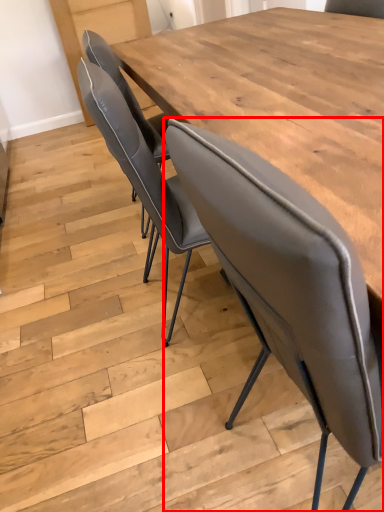
Question: From the image's perspective, considering the relative positions of chair (annotated by the red box) and table in the image provided, where is chair (annotated by the red box) located with respect to the staircase?

Choices:
 (A) below
 (B) above

Answer: (A)